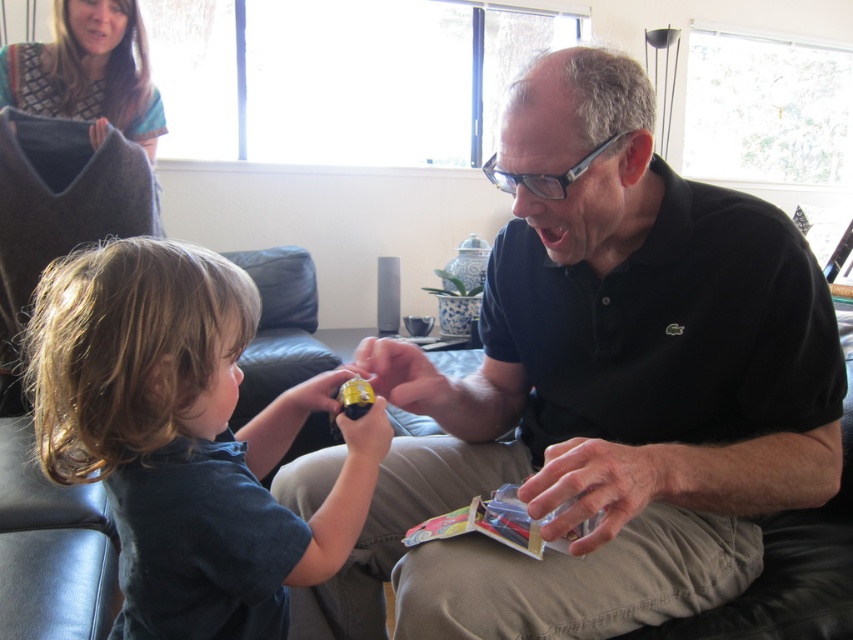
Question: Can you confirm if smooth dark blue shirt at lower left is positioned below translucent plastic cards at center?

Choices:
 (A) yes
 (B) no

Answer: (B)

Question: Which of the following is the farthest from the observer?

Choices:
 (A) translucent plastic cards at center
 (B) black matte shirt at center
 (C) smooth dark blue shirt at lower left

Answer: (A)

Question: Is black matte shirt at center below smooth dark blue shirt at lower left?

Choices:
 (A) no
 (B) yes

Answer: (B)

Question: Which is nearer to the black matte shirt at center?

Choices:
 (A) translucent plastic cards at center
 (B) smooth dark blue shirt at lower left

Answer: (A)

Question: Is black matte shirt at center smaller than translucent plastic cards at center?

Choices:
 (A) yes
 (B) no

Answer: (B)

Question: Among these objects, which one is farthest from the camera?

Choices:
 (A) black matte shirt at center
 (B) translucent plastic cards at center
 (C) smooth dark blue shirt at lower left

Answer: (B)